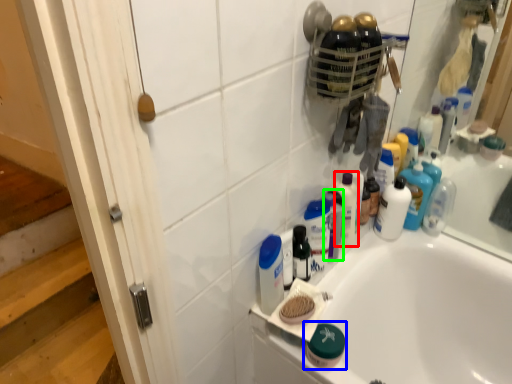
Question: Which object is positioned farthest from toiletry (highlighted by a red box)? Select from toiletry (highlighted by a blue box) and toiletry (highlighted by a green box).

Choices:
 (A) toiletry
 (B) toiletry

Answer: (A)